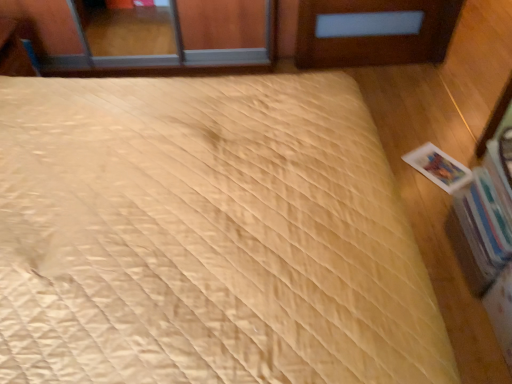
This screenshot has height=384, width=512. Describe the element at coordinates (206, 236) in the screenshot. I see `quilted beige bed at center` at that location.

You are a GUI agent. You are given a task and a screenshot of the screen. Output one action in this format:
    pyautogui.click(x=<x>, y=<y>)
    Task: Click on the quilted beige bed at center
    
    Given the screenshot: What is the action you would take?
    pyautogui.click(x=206, y=236)

The height and width of the screenshot is (384, 512). Identify the location of quilted beige bed at center. (206, 236).